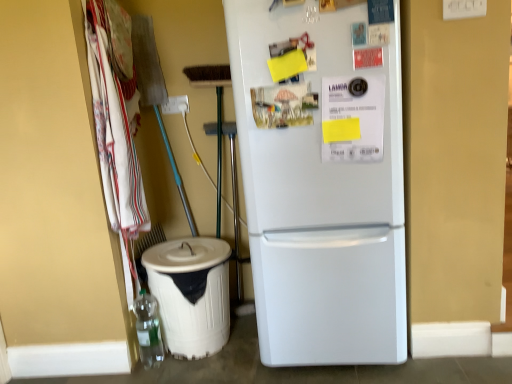
Question: In terms of height, does translucent plastic bottle at lower left look taller or shorter compared to white cotton towels at left?

Choices:
 (A) short
 (B) tall

Answer: (A)

Question: Which is correct: translucent plastic bottle at lower left is inside white cotton towels at left, or outside of it?

Choices:
 (A) outside
 (B) inside

Answer: (A)

Question: Which object is the closest to the white cotton towels at left?

Choices:
 (A) white matte refrigerator at center
 (B) white plastic recycling bin at lower left
 (C) translucent plastic bottle at lower left

Answer: (B)

Question: Estimate the real-world distances between objects in this image. Which object is closer to the white matte refrigerator at center?

Choices:
 (A) white plastic recycling bin at lower left
 (B) white cotton towels at left
 (C) translucent plastic bottle at lower left

Answer: (A)